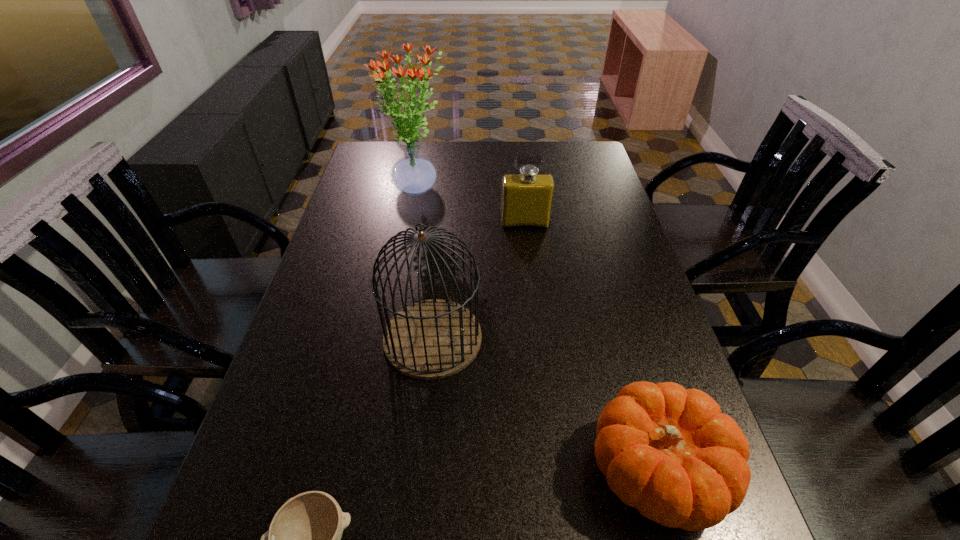
I want to click on object present at the left edge, so coord(413,174).

Where is `object positioned at the far left corner`? object positioned at the far left corner is located at coordinates (413, 174).

This screenshot has height=540, width=960. I want to click on free space at the far edge of the desktop, so click(x=469, y=146).

Where is `free space at the left edge`? This screenshot has width=960, height=540. free space at the left edge is located at coordinates (327, 289).

You are a GUI agent. You are given a task and a screenshot of the screen. Output one action in this format:
    pyautogui.click(x=<x>, y=<y>)
    Task: Click on the vacant region at the right edge of the desktop
    The height and width of the screenshot is (540, 960).
    Given the screenshot: What is the action you would take?
    pyautogui.click(x=580, y=245)

Identify the location of vacant space at the far right corner of the desktop. The width and height of the screenshot is (960, 540). (575, 164).

Identify the location of vacant space that's between the second tallest object and the tallest object. (425, 264).

The width and height of the screenshot is (960, 540). I want to click on vacant region between the farthest object and the third farthest object, so click(x=425, y=264).

Identify which object is the second closest to the tallest object. Please provide its 2D coordinates. Your answer should be formatted as a tuple, i.e. [(x, y)], where the tuple contains the x and y coordinates of a point satisfying the conditions above.

[(431, 339)]

Locate which object is the second closest to the fourth shortest object. Please provide its 2D coordinates. Your answer should be formatted as a tuple, i.e. [(x, y)], where the tuple contains the x and y coordinates of a point satisfying the conditions above.

[(304, 538)]